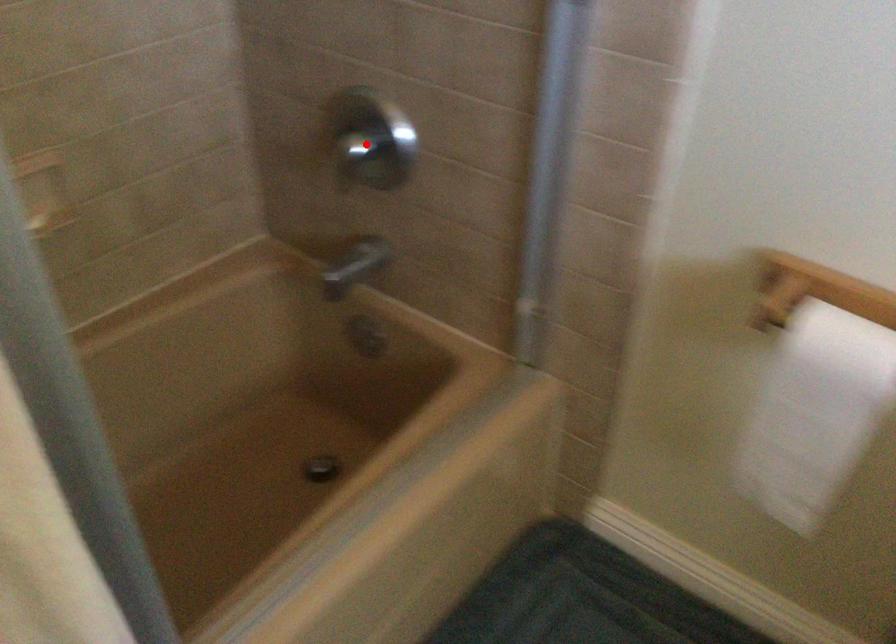
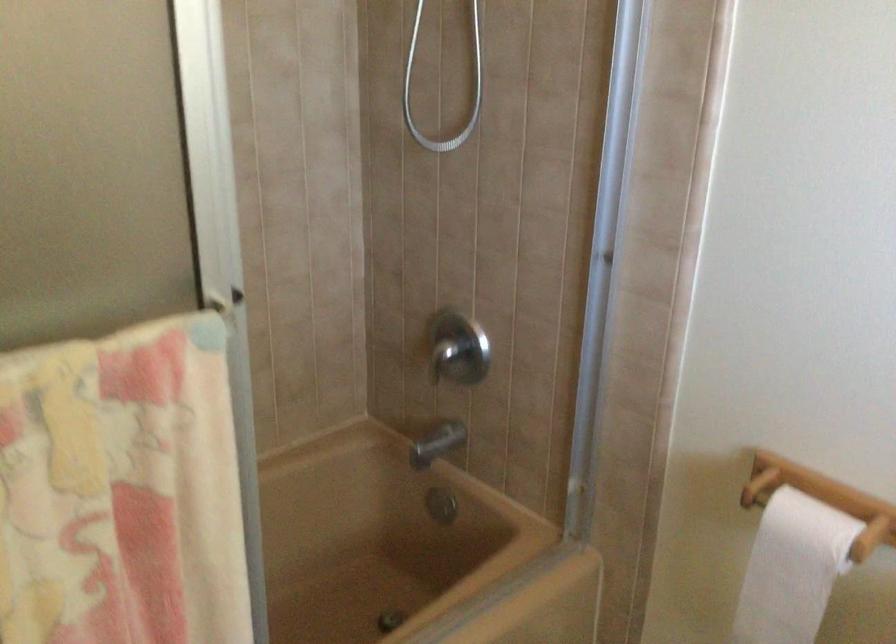
Find the pixel in the second image that matches the highlighted location in the first image.

(458, 348)